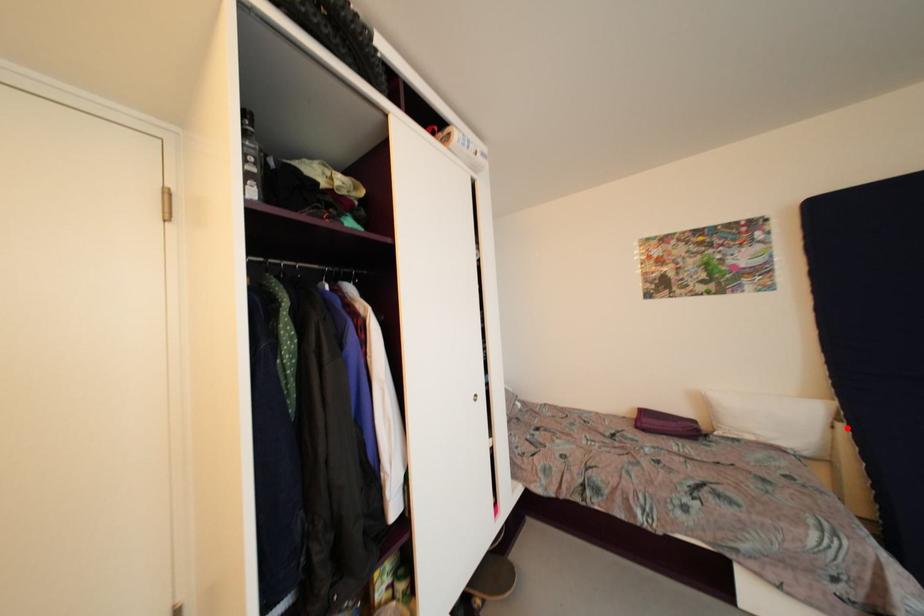
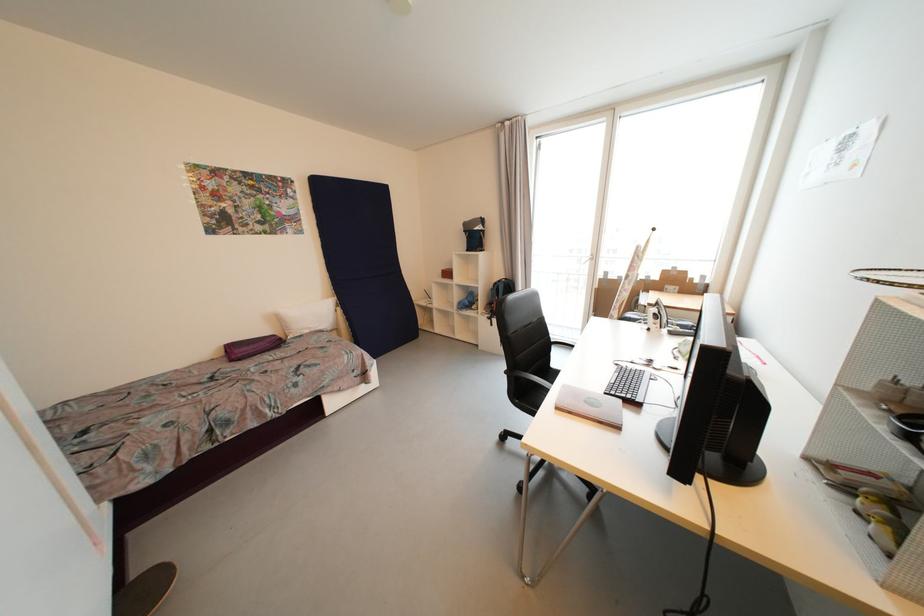
Question: I am providing you with two images of the same scene from different viewpoints. Given a red point in image1, look at the same physical point in image2. Is it:

Choices:
 (A) Closer to the viewpoint
 (B) Farther from the viewpoint

Answer: (B)